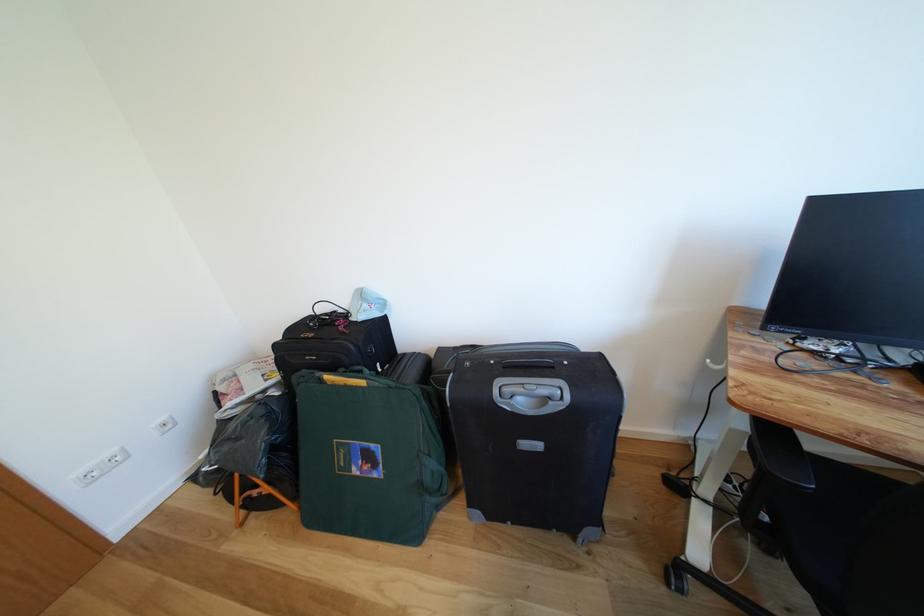
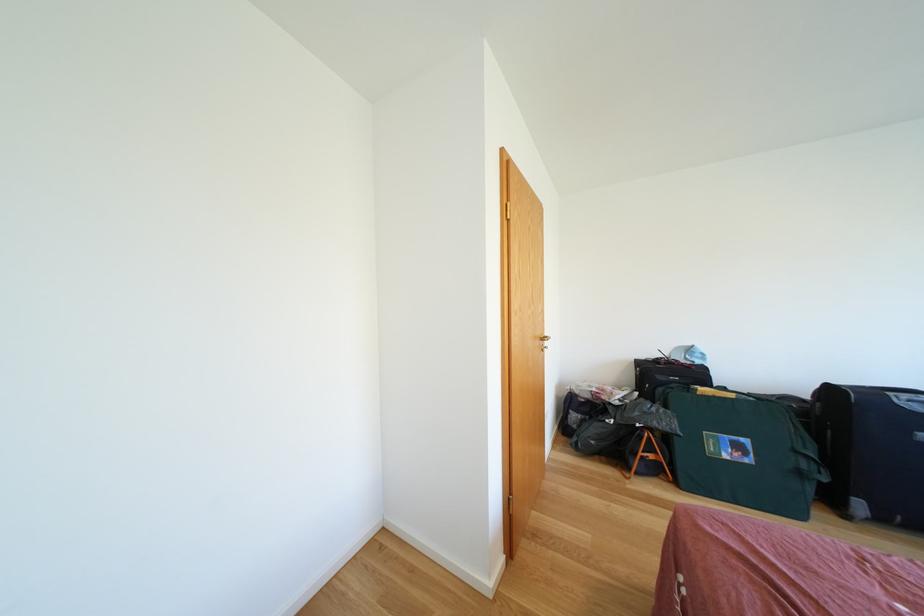
The images are taken continuously from a first-person perspective. In which direction are you moving?

The cameraman moved toward left, backward.